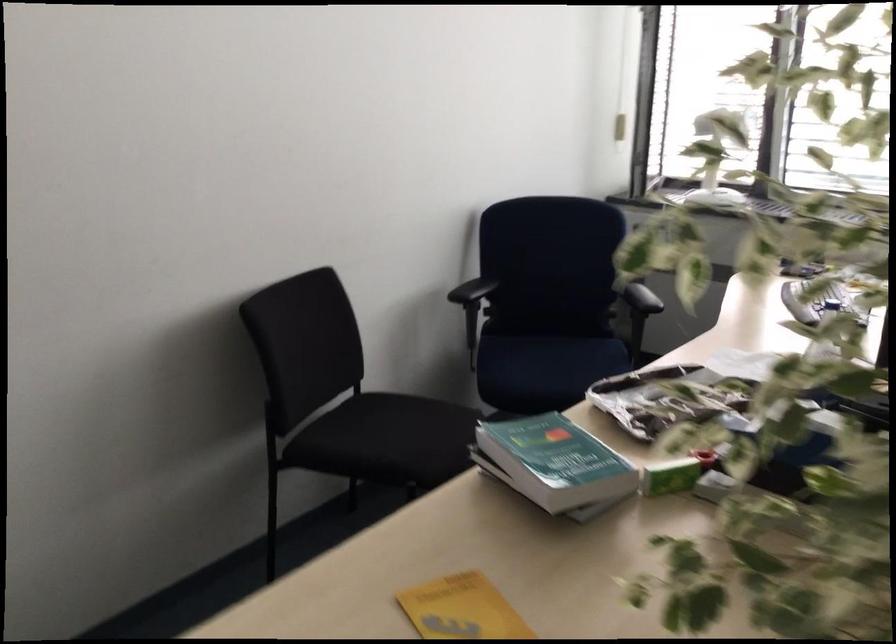
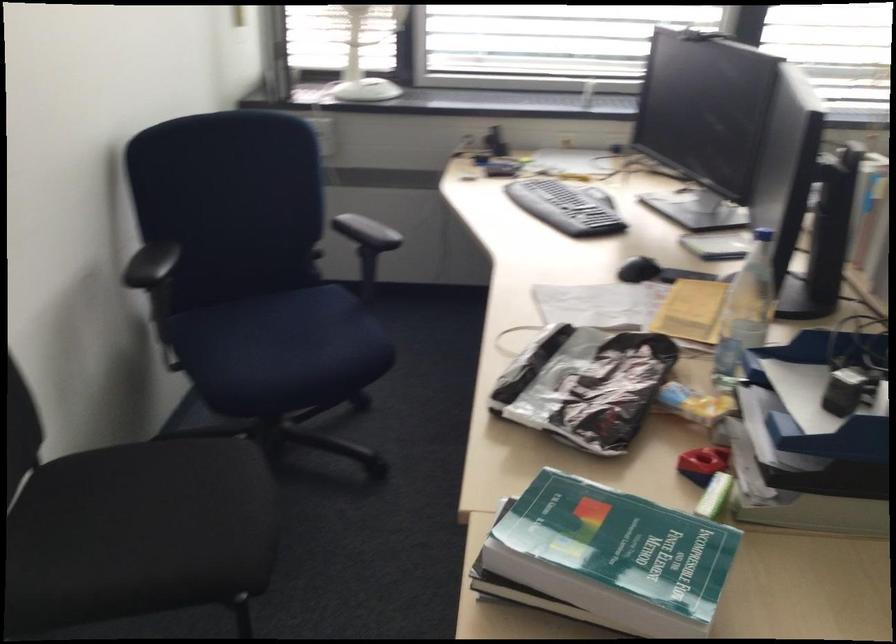
Find the pixel in the second image that matches (397,419) in the first image.

(157, 500)